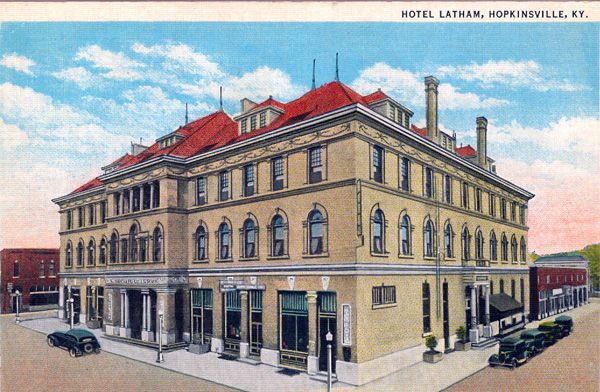
Identify the location of chimneys. (432, 113), (482, 130).